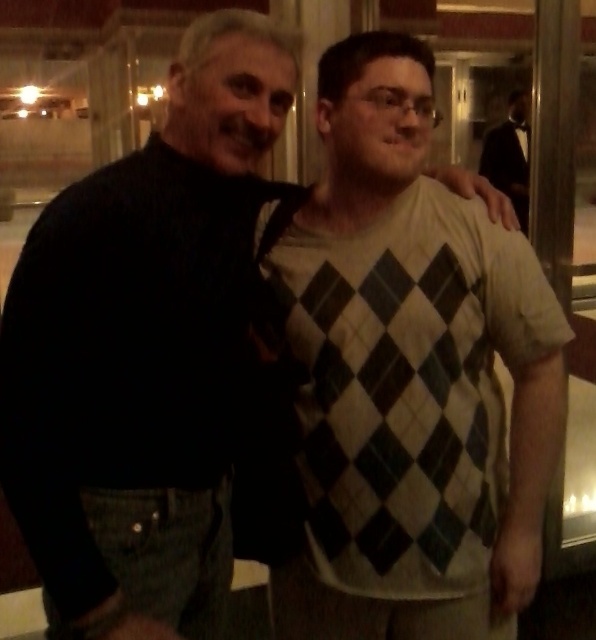
Who is positioned more to the left, argyle sweater at center or black tuxedo at right?

argyle sweater at center

Based on the photo, measure the distance between argyle sweater at center and camera.

argyle sweater at center and camera are 1.14 meters apart from each other.

Is point (319, 513) in front of point (492, 172)?

Yes, point (319, 513) is in front of point (492, 172).

At what (x,y) coordinates should I click in order to perform the action: click on argyle sweater at center. Please return your answer as a coordinate pair (x, y). The image size is (596, 640). Looking at the image, I should click on (408, 376).